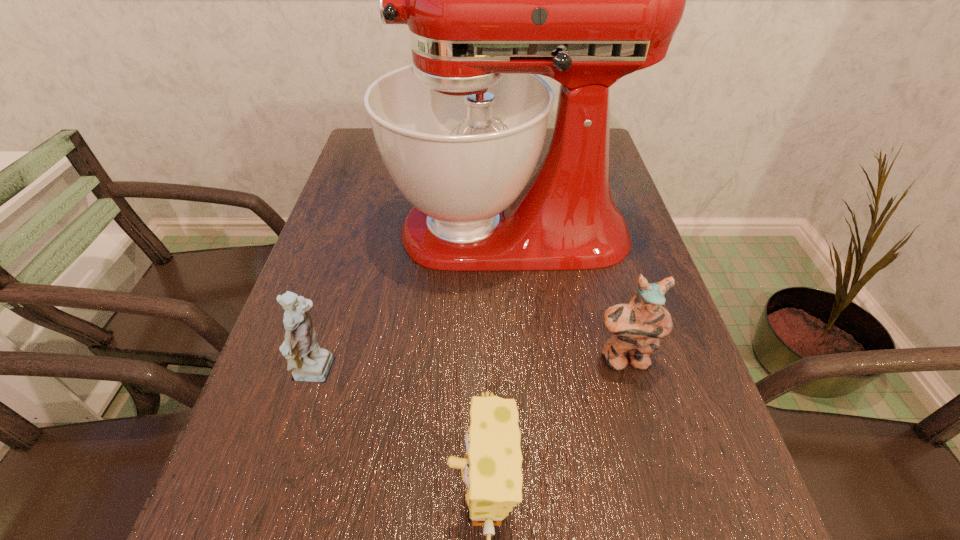
At what (x,y) coordinates should I click in order to perform the action: click on free space between the leftmost object and the right figurine. Please return your answer as a coordinate pair (x, y). The image size is (960, 540). Looking at the image, I should click on (470, 367).

Select which object is the third closest to the left figurine. Please provide its 2D coordinates. Your answer should be formatted as a tuple, i.e. [(x, y)], where the tuple contains the x and y coordinates of a point satisfying the conditions above.

[(637, 327)]

Locate an element on the screen. This screenshot has width=960, height=540. object that stands as the closest to the right figurine is located at coordinates click(492, 0).